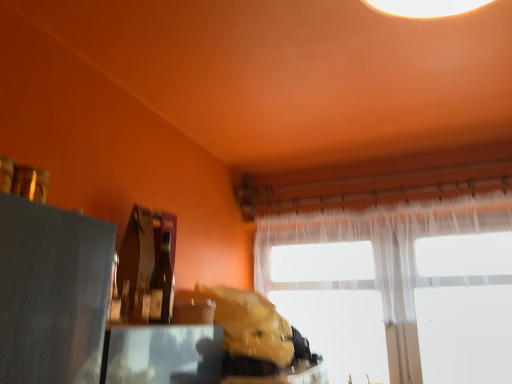
Question: Is matte black table at lower left completely or partially inside leather-like brown bag at center?

Choices:
 (A) yes
 (B) no

Answer: (B)

Question: Is leather-like brown bag at center oriented towards matte black table at lower left?

Choices:
 (A) yes
 (B) no

Answer: (B)

Question: Can you confirm if leather-like brown bag at center is taller than matte black table at lower left?

Choices:
 (A) yes
 (B) no

Answer: (A)

Question: Does leather-like brown bag at center have a greater width compared to matte black table at lower left?

Choices:
 (A) yes
 (B) no

Answer: (A)

Question: Is leather-like brown bag at center turned away from matte black table at lower left?

Choices:
 (A) no
 (B) yes

Answer: (A)

Question: From a real-world perspective, is leather-like brown bag at center positioned above or below matte glass bottle at center?

Choices:
 (A) below
 (B) above

Answer: (A)

Question: Is leather-like brown bag at center inside the boundaries of matte glass bottle at center, or outside?

Choices:
 (A) inside
 (B) outside

Answer: (B)

Question: Is leather-like brown bag at center wider or thinner than matte glass bottle at center?

Choices:
 (A) thin
 (B) wide

Answer: (B)

Question: From their relative heights in the image, would you say leather-like brown bag at center is taller or shorter than matte glass bottle at center?

Choices:
 (A) tall
 (B) short

Answer: (B)

Question: Is point (330, 238) closer or farther from the camera than point (134, 329)?

Choices:
 (A) closer
 (B) farther

Answer: (B)

Question: From the image's perspective, relative to matte black table at lower left, is translucent fabric window at center above or below?

Choices:
 (A) below
 (B) above

Answer: (A)

Question: Considering the positions of translucent fabric window at center and matte black table at lower left in the image, is translucent fabric window at center taller or shorter than matte black table at lower left?

Choices:
 (A) tall
 (B) short

Answer: (A)

Question: Based on their positions, is translucent fabric window at center located to the left or right of matte black table at lower left?

Choices:
 (A) left
 (B) right

Answer: (B)

Question: From their relative heights in the image, would you say matte black table at lower left is taller or shorter than leather-like brown bag at center?

Choices:
 (A) short
 (B) tall

Answer: (A)

Question: From the image's perspective, relative to leather-like brown bag at center, is matte black table at lower left above or below?

Choices:
 (A) above
 (B) below

Answer: (A)